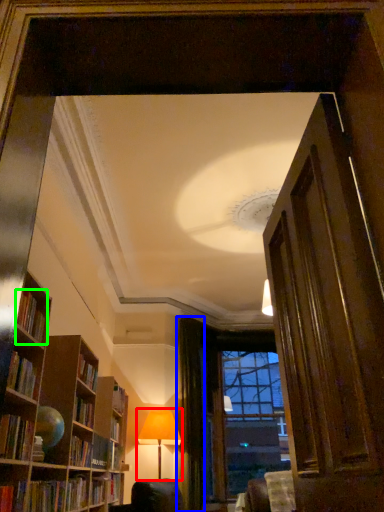
Question: Which object is positioned closest to table lamp (highlighted by a red box)? Select from curtain (highlighted by a blue box) and book (highlighted by a green box).

Choices:
 (A) curtain
 (B) book

Answer: (A)